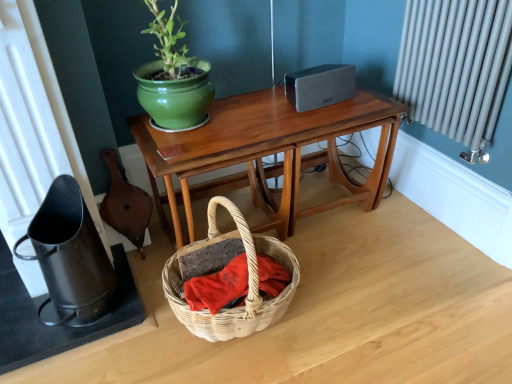
Describe the element at coordinates (219, 287) in the screenshot. The height and width of the screenshot is (384, 512). I see `woven wicker basket at lower center` at that location.

Locate an element on the screen. The height and width of the screenshot is (384, 512). woven wicker basket at lower center is located at coordinates (219, 287).

What do you see at coordinates (266, 153) in the screenshot?
I see `wooden table at center` at bounding box center [266, 153].

This screenshot has width=512, height=384. Find the location of `wooden table at center`. wooden table at center is located at coordinates (266, 153).

Measure the distance between wooden table at center and camera.

wooden table at center is 4.41 feet away from camera.

Where is `woven wicker basket at lower center`? woven wicker basket at lower center is located at coordinates (219, 287).

Which is more to the right, wooden table at center or woven wicker basket at lower center?

wooden table at center.

Which is behind, wooden table at center or woven wicker basket at lower center?

wooden table at center is further from the camera.

Does point (187, 131) lie behind point (276, 290)?

Yes, it is behind point (276, 290).

From the image's perspective, is wooden table at center above woven wicker basket at lower center?

Yes.

From a real-world perspective, which is physically below, wooden table at center or woven wicker basket at lower center?

woven wicker basket at lower center is physically lower.

Between wooden table at center and woven wicker basket at lower center, which one has smaller width?

woven wicker basket at lower center is thinner.

Which of these two, wooden table at center or woven wicker basket at lower center, stands shorter?

With less height is woven wicker basket at lower center.

Can you confirm if wooden table at center is bigger than woven wicker basket at lower center?

Correct, wooden table at center is larger in size than woven wicker basket at lower center.

Do you think wooden table at center is within woven wicker basket at lower center, or outside of it?

wooden table at center is outside woven wicker basket at lower center.

Can you see wooden table at center touching woven wicker basket at lower center?

No, wooden table at center is not beside woven wicker basket at lower center.

Looking at this image, is wooden table at center turned away from woven wicker basket at lower center?

That's not correct — wooden table at center is not looking away from woven wicker basket at lower center.

This screenshot has height=384, width=512. I want to click on table on the right side of woven wicker basket at lower center, so click(266, 153).

Based on the photo, which object is positioned more to the left, woven wicker basket at lower center or wooden table at center?

woven wicker basket at lower center.

Is the position of woven wicker basket at lower center more distant than that of wooden table at center?

No, woven wicker basket at lower center is closer to the viewer.

Looking at this image, which point is more distant from viewer, (261, 257) or (146, 148)?

The point (146, 148) is behind.

From the image's perspective, between woven wicker basket at lower center and wooden table at center, who is located below?

woven wicker basket at lower center.

From a real-world perspective, is woven wicker basket at lower center positioned above or below wooden table at center?

In terms of real-world spatial position, woven wicker basket at lower center is below wooden table at center.

Which object is thinner, woven wicker basket at lower center or wooden table at center?

woven wicker basket at lower center is thinner.

From their relative heights in the image, would you say woven wicker basket at lower center is taller or shorter than wooden table at center?

In the image, woven wicker basket at lower center appears to be shorter than wooden table at center.

Between woven wicker basket at lower center and wooden table at center, which one has smaller size?

With smaller size is woven wicker basket at lower center.

Is wooden table at center surrounded by woven wicker basket at lower center?

Definitely not — wooden table at center is not inside woven wicker basket at lower center.

Consider the image. Is woven wicker basket at lower center not near wooden table at center?

Actually, woven wicker basket at lower center and wooden table at center are a little close together.

Is woven wicker basket at lower center oriented towards wooden table at center?

No, woven wicker basket at lower center is not aimed at wooden table at center.

How many degrees apart are the facing directions of woven wicker basket at lower center and wooden table at center?

The angle between the facing direction of woven wicker basket at lower center and the facing direction of wooden table at center is 0.653 degrees.

Measure the distance from woven wicker basket at lower center to wooden table at center.

They are 18.63 inches apart.

In order to click on material lying below the wooden table at center (from the image's perspective) in this screenshot , I will do `click(219, 287)`.

This screenshot has width=512, height=384. I want to click on material that appears on the left of wooden table at center, so click(219, 287).

Locate an element on the screen. The width and height of the screenshot is (512, 384). material below the wooden table at center (from the image's perspective) is located at coordinates (219, 287).